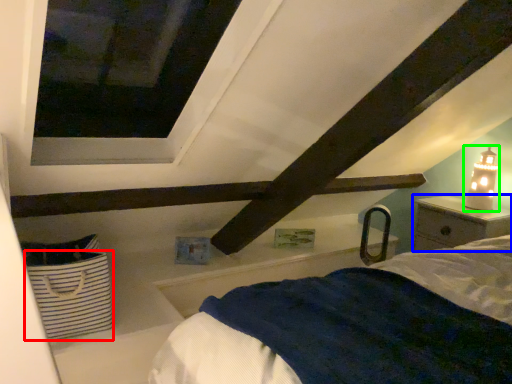
Question: Considering the real-world distances, which object is closest to basket (highlighted by a red box)? nightstand (highlighted by a blue box) or table lamp (highlighted by a green box).

Choices:
 (A) nightstand
 (B) table lamp

Answer: (A)